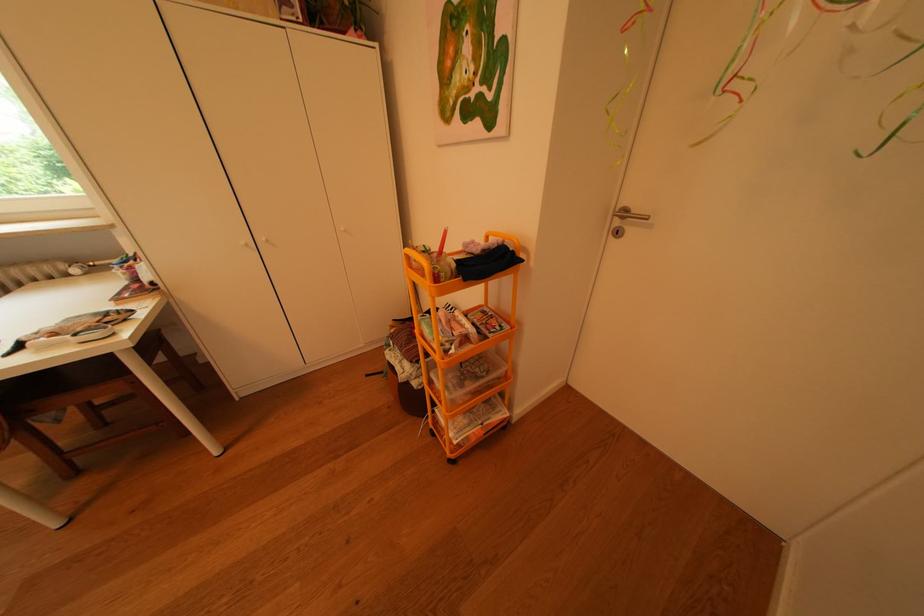
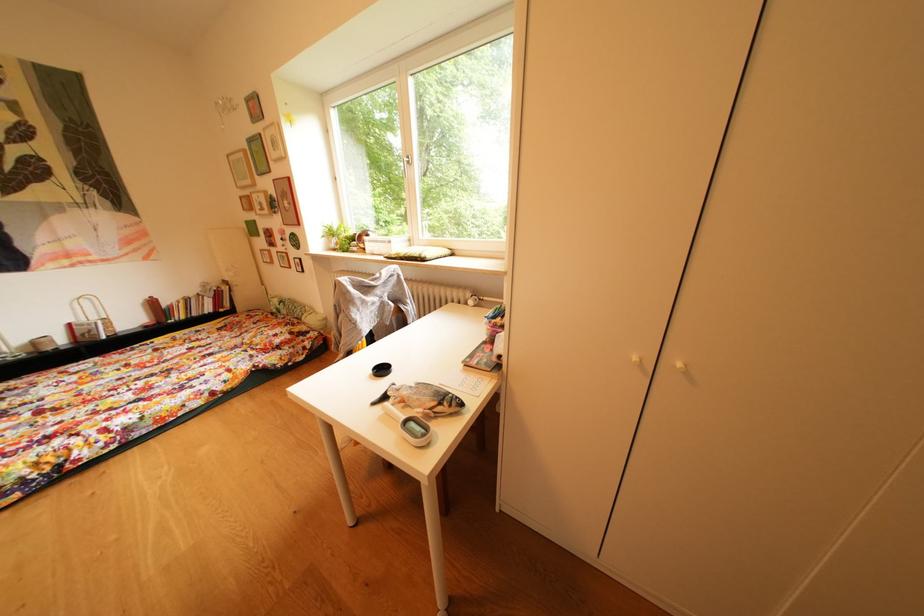
Question: The camera is either moving clockwise (left) or counter-clockwise (right) around the object. The first image is from the beginning of the video and the second image is from the end. Is the camera moving left or right when shooting the video?

Choices:
 (A) Left
 (B) Right

Answer: (B)